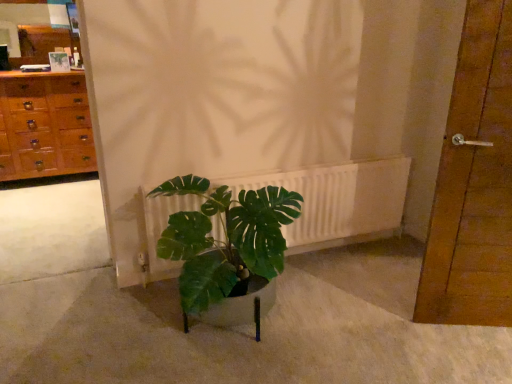
Describe the element at coordinates (44, 126) in the screenshot. I see `wooden chest of drawers at left` at that location.

Describe the element at coordinates (474, 183) in the screenshot. I see `brown wooden door at right` at that location.

I want to click on white matte radiator at center, so click(x=338, y=201).

Is white matte radiator at center thinner than wooden chest of drawers at left?

Yes, white matte radiator at center is thinner than wooden chest of drawers at left.

Is white matte radiator at center positioned with its back to wooden chest of drawers at left?

That's right, white matte radiator at center is facing away from wooden chest of drawers at left.

Choose the correct answer: Is white matte radiator at center inside wooden chest of drawers at left or outside it?

white matte radiator at center lies outside wooden chest of drawers at left.

Considering the positions of point (401, 175) and point (56, 82), is point (401, 175) closer or farther from the camera than point (56, 82)?

Point (401, 175) is positioned closer to the camera compared to point (56, 82).

At what (x,y) coordinates should I click in order to perform the action: click on radiator lying in front of the matte wooden mirror at upper left. Please return your answer as a coordinate pair (x, y). The image size is (512, 384). Looking at the image, I should click on (338, 201).

What's the angular difference between white matte radiator at center and matte wooden mirror at upper left's facing directions?

The angle between the facing direction of white matte radiator at center and the facing direction of matte wooden mirror at upper left is 0.291 degrees.

From the image's perspective, which is above, white matte radiator at center or matte wooden mirror at upper left?

matte wooden mirror at upper left appears higher in the image.

Relative to matte wooden mirror at upper left, is white matte radiator at center in front or behind?

Clearly, white matte radiator at center is in front of matte wooden mirror at upper left.

How different are the orientations of brown wooden door at right and matte wooden mirror at upper left in degrees?

The facing directions of brown wooden door at right and matte wooden mirror at upper left are 22.3 degrees apart.

Is brown wooden door at right oriented away from matte wooden mirror at upper left?

brown wooden door at right is not turned away from matte wooden mirror at upper left.

From a real-world perspective, which object stands above the other?

matte wooden mirror at upper left.

From their relative heights in the image, would you say brown wooden door at right is taller or shorter than matte wooden mirror at upper left?

brown wooden door at right is taller than matte wooden mirror at upper left.

Can you confirm if white matte radiator at center is positioned to the left of brown wooden door at right?

Yes.

Considering the relative positions of white matte radiator at center and brown wooden door at right in the image provided, is white matte radiator at center in front of brown wooden door at right?

No, white matte radiator at center is further to the viewer.

Does white matte radiator at center turn towards brown wooden door at right?

Yes, white matte radiator at center is oriented towards brown wooden door at right.

From a real-world perspective, is white matte radiator at center physically below brown wooden door at right?

Yes.

Between matte wooden mirror at upper left and brown wooden door at right, which one appears on the left side from the viewer's perspective?

matte wooden mirror at upper left.

The width and height of the screenshot is (512, 384). Identify the location of mirror located on the left of brown wooden door at right. (34, 30).

Considering the positions of objects matte wooden mirror at upper left and brown wooden door at right in the image provided, who is behind, matte wooden mirror at upper left or brown wooden door at right?

matte wooden mirror at upper left is further from the camera.

Is matte wooden mirror at upper left not within brown wooden door at right?

Absolutely, matte wooden mirror at upper left is external to brown wooden door at right.

Considering the relative positions of matte wooden mirror at upper left and white matte radiator at center in the image provided, is matte wooden mirror at upper left to the right of white matte radiator at center from the viewer's perspective?

In fact, matte wooden mirror at upper left is to the left of white matte radiator at center.

From a real-world perspective, which is physically below, matte wooden mirror at upper left or white matte radiator at center?

white matte radiator at center.

Is matte wooden mirror at upper left far away from white matte radiator at center?

matte wooden mirror at upper left is far away from white matte radiator at center.

Looking at this image, from the image's perspective, which one is positioned lower, matte wooden mirror at upper left or white matte radiator at center?

white matte radiator at center, from the image's perspective.

Are matte wooden mirror at upper left and wooden chest of drawers at left far apart?

Actually, matte wooden mirror at upper left and wooden chest of drawers at left are a little close together.

Which of these two, matte wooden mirror at upper left or wooden chest of drawers at left, is wider?

wooden chest of drawers at left.

Where is `mirror behind the wooden chest of drawers at left`? mirror behind the wooden chest of drawers at left is located at coordinates pyautogui.click(x=34, y=30).

Based on their positions, is matte wooden mirror at upper left located to the left or right of wooden chest of drawers at left?

matte wooden mirror at upper left is positioned on wooden chest of drawers at left's right side.

Identify the location of the chest of drawers located above the white matte radiator at center (from a real-world perspective). The width and height of the screenshot is (512, 384). (44, 126).

I want to click on mirror located on the left of white matte radiator at center, so tap(34, 30).

Which object lies nearer to the anchor point brown wooden door at right, matte wooden mirror at upper left or white matte radiator at center?

white matte radiator at center is positioned closer to the anchor brown wooden door at right.

Considering their positions, is wooden chest of drawers at left positioned further to matte wooden mirror at upper left than brown wooden door at right?

brown wooden door at right lies further to matte wooden mirror at upper left than the other object.

Estimate the real-world distances between objects in this image. Which object is closer to brown wooden door at right, white matte radiator at center or matte wooden mirror at upper left?

Among the two, white matte radiator at center is located nearer to brown wooden door at right.

Looking at the image, which one is located further to wooden chest of drawers at left, matte wooden mirror at upper left or white matte radiator at center?

Among the two, white matte radiator at center is located further to wooden chest of drawers at left.

Which object lies further to the anchor point matte wooden mirror at upper left, white matte radiator at center or wooden chest of drawers at left?

white matte radiator at center lies further to matte wooden mirror at upper left than the other object.

Looking at the image, which one is located closer to wooden chest of drawers at left, brown wooden door at right or white matte radiator at center?

Among the two, white matte radiator at center is located nearer to wooden chest of drawers at left.

Considering their positions, is brown wooden door at right positioned closer to white matte radiator at center than matte wooden mirror at upper left?

brown wooden door at right.

Which object lies further to the anchor point wooden chest of drawers at left, white matte radiator at center or brown wooden door at right?

brown wooden door at right lies further to wooden chest of drawers at left than the other object.

Where is `mirror located between wooden chest of drawers at left and brown wooden door at right in the left-right direction`? Image resolution: width=512 pixels, height=384 pixels. mirror located between wooden chest of drawers at left and brown wooden door at right in the left-right direction is located at coordinates (34, 30).

The width and height of the screenshot is (512, 384). What are the coordinates of `mirror located between wooden chest of drawers at left and white matte radiator at center in the left-right direction` in the screenshot? It's located at [34, 30].

Identify the location of radiator between wooden chest of drawers at left and brown wooden door at right. (338, 201).

The height and width of the screenshot is (384, 512). I want to click on radiator located between matte wooden mirror at upper left and brown wooden door at right in the left-right direction, so click(338, 201).